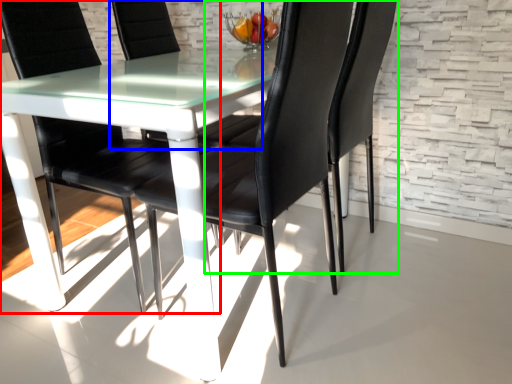
Question: Considering the real-world distances, which object is closest to chair (highlighted by a red box)? chair (highlighted by a blue box) or chair (highlighted by a green box).

Choices:
 (A) chair
 (B) chair

Answer: (A)